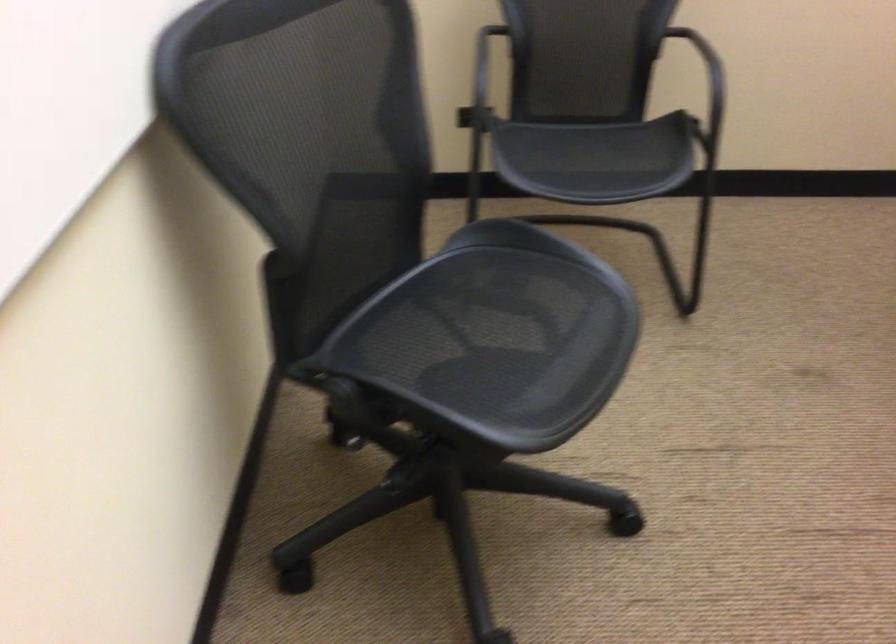
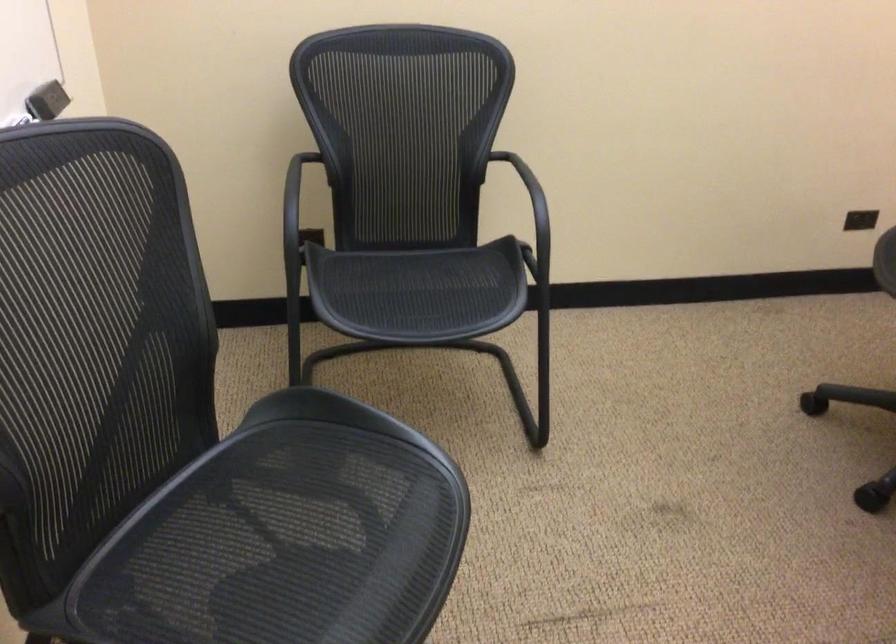
The images are taken continuously from a first-person perspective. In which direction are you moving?

The cameraman moved toward right, forward.